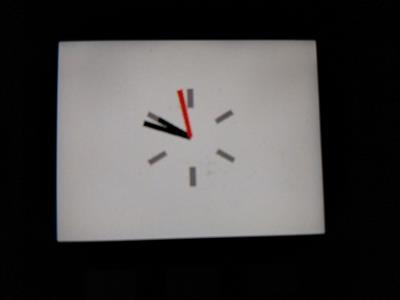
Identify the location of white clock face. (270, 200).